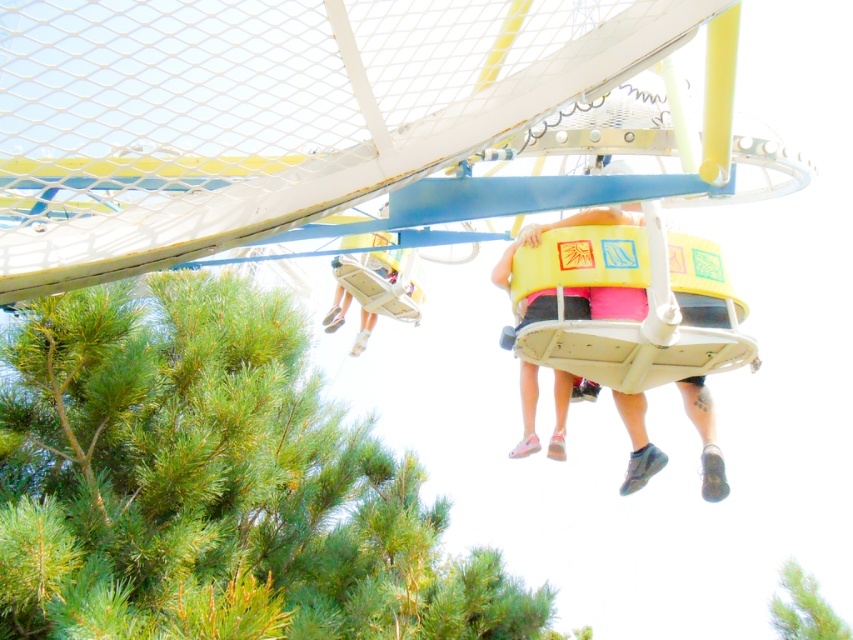
Question: Which of these objects is positioned closest to the yellow plastic bucket at center?

Choices:
 (A) green leafy tree at lower left
 (B) yellow matte seat at center

Answer: (A)

Question: Which point appears closest to the camera in this image?

Choices:
 (A) (595, 209)
 (B) (367, 324)

Answer: (A)

Question: Is green leafy tree at lower left to the left of yellow matte seat at center from the viewer's perspective?

Choices:
 (A) no
 (B) yes

Answer: (B)

Question: Which point is farther to the camera?

Choices:
 (A) (373, 253)
 (B) (552, 317)

Answer: (A)

Question: Is yellow matte seat at center to the right of yellow plastic bucket at center from the viewer's perspective?

Choices:
 (A) no
 (B) yes

Answer: (B)

Question: Can you confirm if green leafy tree at lower left is positioned above yellow matte seat at center?

Choices:
 (A) no
 (B) yes

Answer: (A)